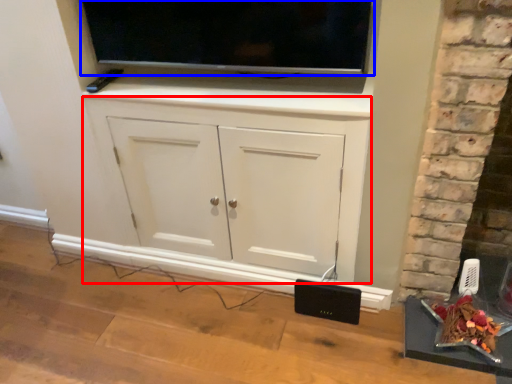
Question: Which object is closer to the camera taking this photo, cabinetry (highlighted by a red box) or television (highlighted by a blue box)?

Choices:
 (A) cabinetry
 (B) television

Answer: (B)